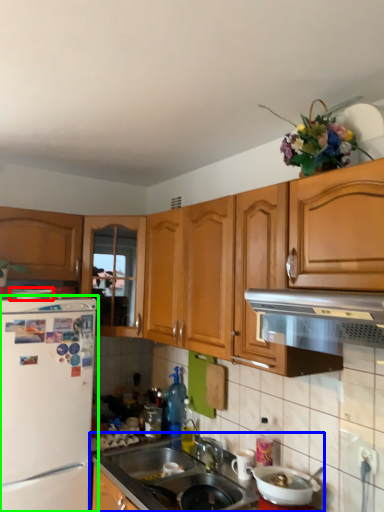
Question: Which object is the farthest from appliance (highlighted by a red box)? Choose among these: countertop (highlighted by a blue box) or refrigerator (highlighted by a green box).

Choices:
 (A) countertop
 (B) refrigerator

Answer: (A)